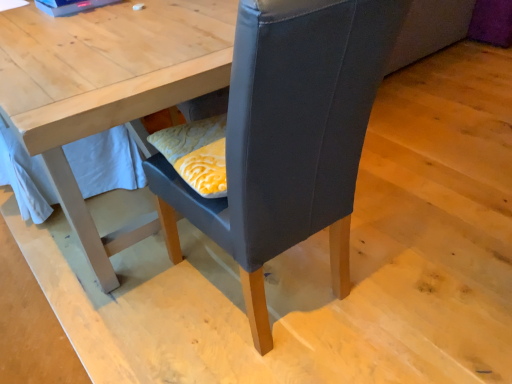
Identify the location of matte black chair at center. 288,137.

What do you see at coordinates (288, 137) in the screenshot? Image resolution: width=512 pixels, height=384 pixels. I see `matte black chair at center` at bounding box center [288, 137].

Where is `matte black chair at center`? matte black chair at center is located at coordinates (288, 137).